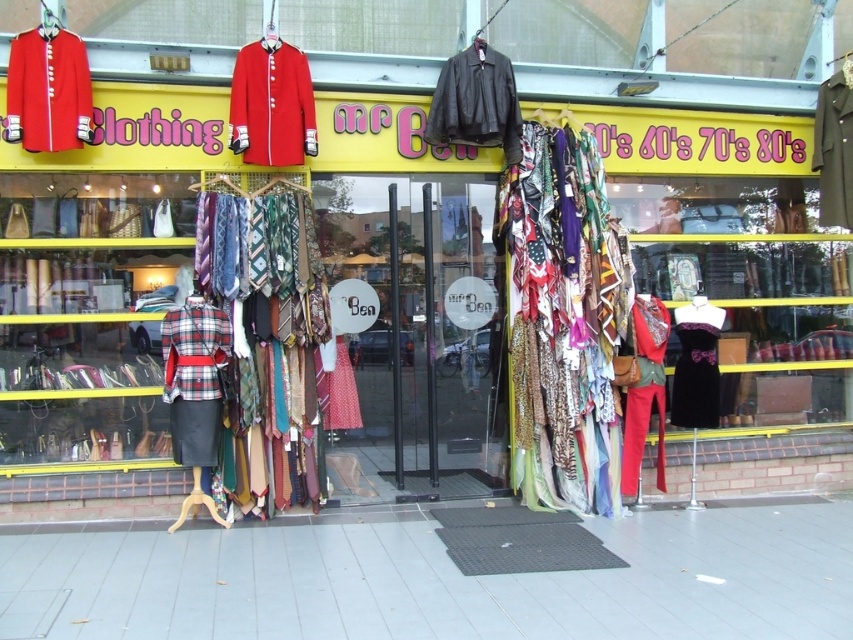
Question: Is leather jacket at upper center thinner than matte red pants at center?

Choices:
 (A) no
 (B) yes

Answer: (A)

Question: Which object appears farthest from the camera in this image?

Choices:
 (A) leather jacket at upper center
 (B) printed fabric scarf at center

Answer: (B)

Question: Is matte red coat at center below matte red military coat at upper left?

Choices:
 (A) no
 (B) yes

Answer: (B)

Question: Which point is closer to the camera?

Choices:
 (A) matte black jacket at upper right
 (B) matte red military coat at upper left
 (C) transparent glass door at center
 (D) matte red coat at center

Answer: (B)

Question: Which point is closer to the camera?

Choices:
 (A) velvet black dress at center
 (B) matte red military coat at upper left
 (C) transparent glass door at center
 (D) matte red coat at center

Answer: (B)

Question: Can you confirm if velvet black dress at center is positioned above matte black jacket at upper right?

Choices:
 (A) no
 (B) yes

Answer: (A)